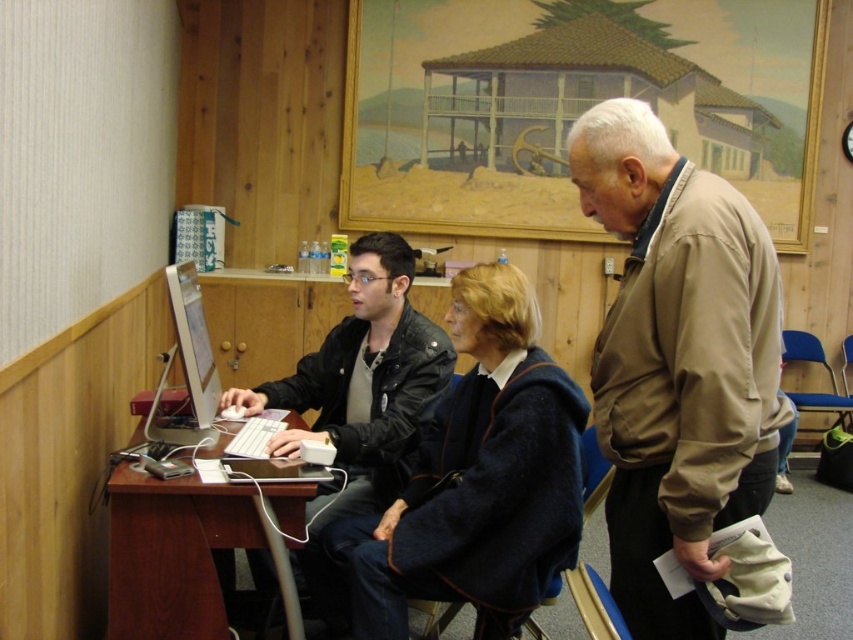
You are standing in the room and want to hand a document to the person wearing the navy blue sweater at center. The document is on the matte plastic monitor at center left. Can you reach the document without moving either object?

The navy blue sweater at center is closer to the viewer than the matte plastic monitor at center left, so you can reach the document on the matte plastic monitor at center left by extending your arm towards it since it is behind the sweater.

You are standing in the room described and need to place a large potted plant on the brown wooden table at lower left. Based on the coordinates provided in the Objects Description, can you confirm the exact location where the table is situated?

The brown wooden table at lower left is located at point (190, 550), so the potted plant should be placed there.